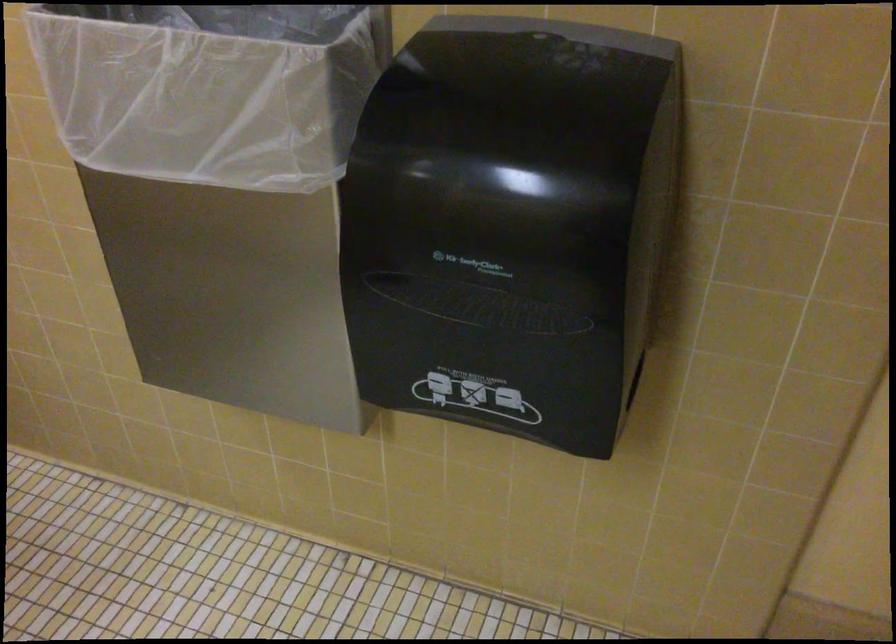
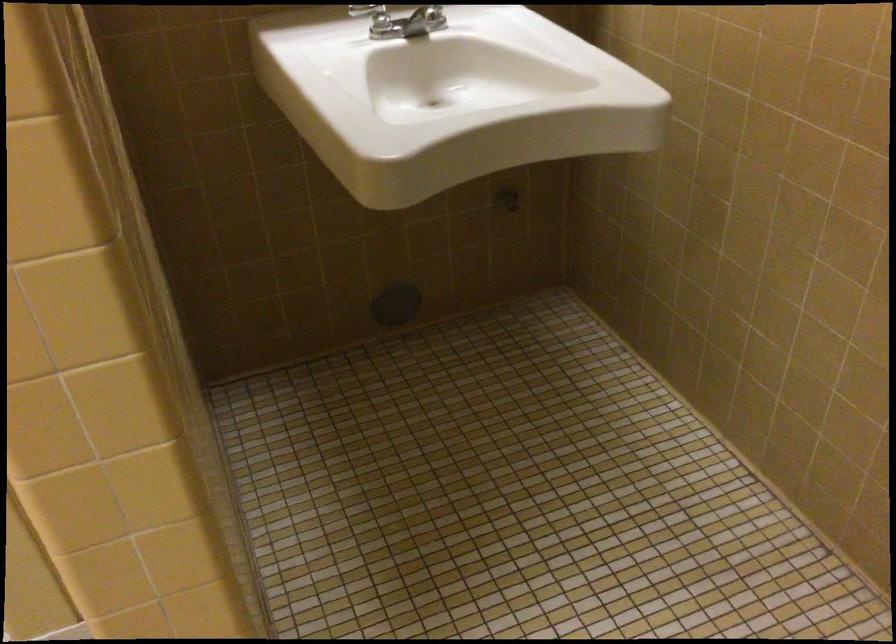
Question: The camera is either moving clockwise (left) or counter-clockwise (right) around the object. The first image is from the beginning of the video and the second image is from the end. Is the camera moving left or right when shooting the video?

Choices:
 (A) Left
 (B) Right

Answer: (B)